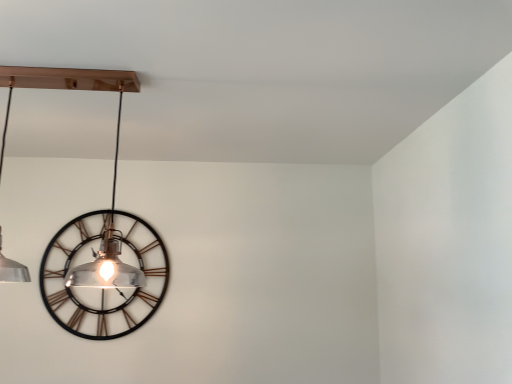
Identify the location of clear glass pendant light at center. (96, 235).

What do you see at coordinates (96, 235) in the screenshot?
I see `clear glass pendant light at center` at bounding box center [96, 235].

What is the approximate height of metallic black clock at left?

71.93 centimeters.

The height and width of the screenshot is (384, 512). Find the location of `metallic black clock at left`. metallic black clock at left is located at coordinates (101, 277).

The image size is (512, 384). Describe the element at coordinates (101, 277) in the screenshot. I see `metallic black clock at left` at that location.

Locate an element on the screen. The width and height of the screenshot is (512, 384). clear glass pendant light at center is located at coordinates (96, 235).

Is clear glass pendant light at center to the right of metallic black clock at left from the viewer's perspective?

Yes, clear glass pendant light at center is to the right of metallic black clock at left.

Is clear glass pendant light at center in front of or behind metallic black clock at left in the image?

clear glass pendant light at center is in front of metallic black clock at left.

Between point (102, 250) and point (121, 310), which one is positioned behind?

The point (121, 310) is behind.

From the image's perspective, is clear glass pendant light at center located beneath metallic black clock at left?

Actually, clear glass pendant light at center appears above metallic black clock at left in the image.

From a real-world perspective, is clear glass pendant light at center on top of metallic black clock at left?

Indeed, from a real-world perspective, clear glass pendant light at center stands above metallic black clock at left.

In the scene shown: Can you confirm if clear glass pendant light at center is thinner than metallic black clock at left?

No, clear glass pendant light at center is not thinner than metallic black clock at left.

Which of these two, clear glass pendant light at center or metallic black clock at left, stands shorter?

clear glass pendant light at center is shorter.

Does clear glass pendant light at center have a larger size compared to metallic black clock at left?

Yes, clear glass pendant light at center is bigger than metallic black clock at left.

Is metallic black clock at left located within clear glass pendant light at center?

No, clear glass pendant light at center does not contain metallic black clock at left.

Is clear glass pendant light at center next to metallic black clock at left?

Absolutely, clear glass pendant light at center is next to and touching metallic black clock at left.

Could you tell me if clear glass pendant light at center is facing metallic black clock at left?

No, clear glass pendant light at center is not turned towards metallic black clock at left.

Locate an element on the screen. Image resolution: width=512 pixels, height=384 pixels. lamp in front of the metallic black clock at left is located at coordinates pos(96,235).

Which object is positioned more to the left, metallic black clock at left or clear glass pendant light at center?

From the viewer's perspective, metallic black clock at left appears more on the left side.

Which object is closer to the camera, metallic black clock at left or clear glass pendant light at center?

Positioned in front is clear glass pendant light at center.

Does point (113, 236) come behind point (59, 280)?

No, (113, 236) is in front of (59, 280).

From the image's perspective, is metallic black clock at left located above or below clear glass pendant light at center?

From the image's perspective, metallic black clock at left appears below clear glass pendant light at center.

Consider the image. From a real-world perspective, is metallic black clock at left on top of clear glass pendant light at center?

Incorrect, from a real-world perspective, metallic black clock at left is lower than clear glass pendant light at center.

Based on the photo, between metallic black clock at left and clear glass pendant light at center, which one has larger width?

Answer: clear glass pendant light at center is wider.

Who is shorter, metallic black clock at left or clear glass pendant light at center?

Standing shorter between the two is clear glass pendant light at center.

Looking at this image, which of these two, metallic black clock at left or clear glass pendant light at center, is bigger?

clear glass pendant light at center.

Do you think metallic black clock at left is within clear glass pendant light at center, or outside of it?

The correct answer is: outside.

From the picture: Is there a large distance between metallic black clock at left and clear glass pendant light at center?

No, metallic black clock at left is not far away from clear glass pendant light at center.

Based on the photo, is metallic black clock at left aimed at clear glass pendant light at center?

Yes, metallic black clock at left is aimed at clear glass pendant light at center.

Locate an element on the screen. The height and width of the screenshot is (384, 512). lamp above the metallic black clock at left (from the image's perspective) is located at coordinates (96, 235).

There is a metallic black clock at left. Identify the location of lamp above it (from a real-world perspective). (96, 235).

Find the location of `lamp lying on the right of metallic black clock at left`. lamp lying on the right of metallic black clock at left is located at coordinates (96, 235).